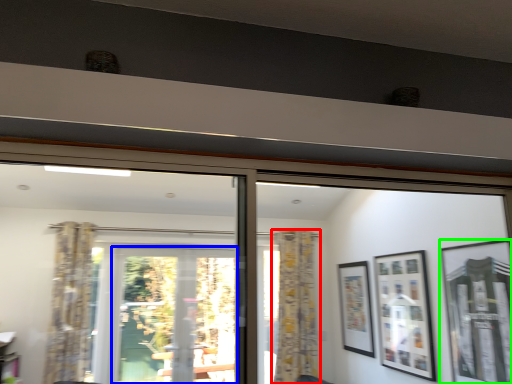
Question: Based on their relative distances, which object is nearer to curtain (highlighted by a red box)? Choose from screen door (highlighted by a blue box) and picture frame (highlighted by a green box).

Choices:
 (A) screen door
 (B) picture frame

Answer: (A)